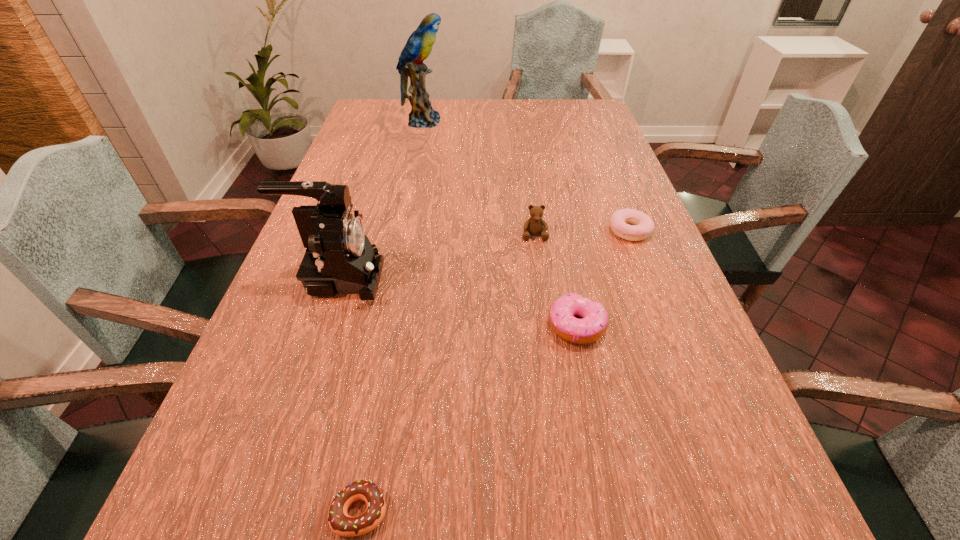
Identify the location of vacant position at the far edge of the desktop. (444, 104).

In order to click on vacant space at the left edge of the desktop in this screenshot , I will do `click(239, 395)`.

The height and width of the screenshot is (540, 960). Identify the location of blank space at the right edge. 616,146.

The height and width of the screenshot is (540, 960). In the image, there is a desktop. What are the coordinates of `free space at the far right corner` in the screenshot? It's located at (588, 117).

The width and height of the screenshot is (960, 540). I want to click on unoccupied area between the second shortest object and the tallest object, so click(x=526, y=176).

The height and width of the screenshot is (540, 960). What are the coordinates of `free space between the second doughnut from left to right and the second shortest doughnut` in the screenshot? It's located at (603, 278).

Identify the location of free spot between the teddy bear and the farthest object. (479, 178).

At what (x,y) coordinates should I click in order to perform the action: click on free space that is in between the parrot and the teddy bear. Please return your answer as a coordinate pair (x, y). Looking at the image, I should click on 479,178.

At what (x,y) coordinates should I click in order to perform the action: click on vacant region between the parrot and the camcorder. Please return your answer as a coordinate pair (x, y). Looking at the image, I should click on (381, 200).

I want to click on free spot between the second doughnut from left to right and the leftmost doughnut, so click(468, 418).